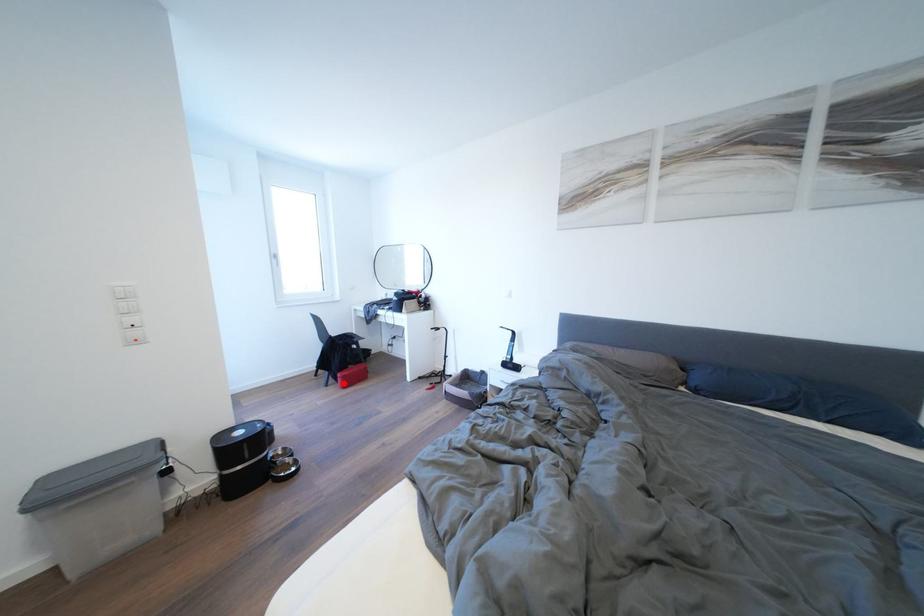
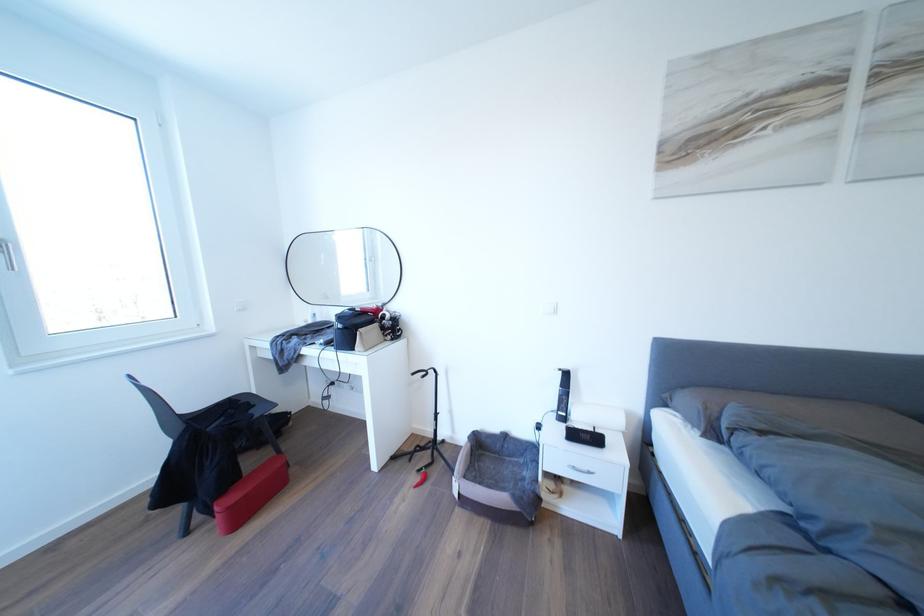
Where in the second image is the point corresponding to the highlighted location from the first image?

(217, 519)